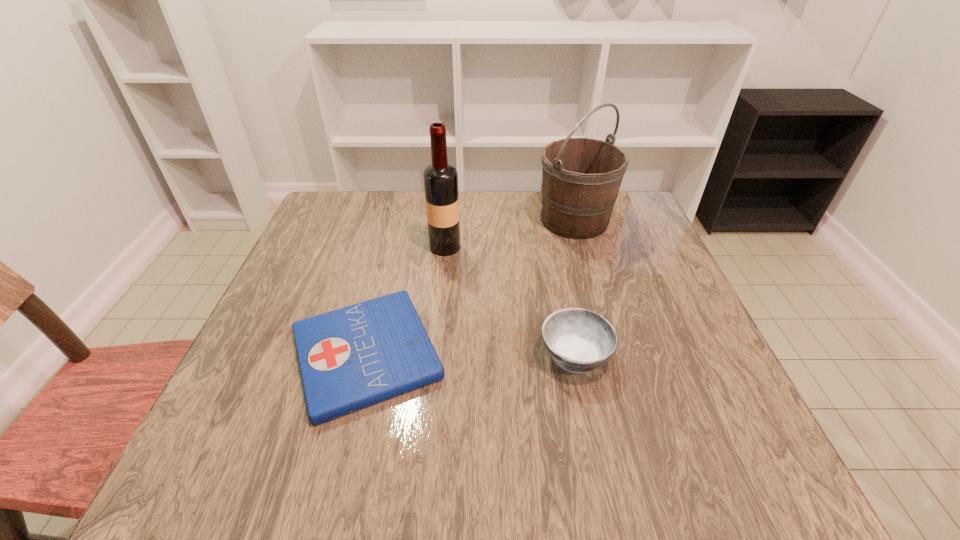
You are a GUI agent. You are given a task and a screenshot of the screen. Output one action in this format:
    pyautogui.click(x=<x>, y=<y>)
    Task: Click on the object present at the left edge
    Image resolution: width=960 pixels, height=540 pixels.
    Given the screenshot: What is the action you would take?
    pos(350,358)

This screenshot has height=540, width=960. Find the location of `object that is at the right edge`. object that is at the right edge is located at coordinates (581, 177).

Identify the location of object situated at the far right corner. This screenshot has width=960, height=540. (581, 177).

In the image, there is a desktop. What are the coordinates of `blank space at the far edge` in the screenshot? It's located at (493, 197).

In the image, there is a desktop. What are the coordinates of `vacant region at the left edge` in the screenshot? It's located at (339, 295).

Locate an element on the screen. The image size is (960, 540). vacant space at the far left corner is located at coordinates (341, 232).

You are a GUI agent. You are given a task and a screenshot of the screen. Output one action in this format:
    pyautogui.click(x=<x>, y=<y>)
    Task: Click on the vacant space at the far right corner
    
    Given the screenshot: What is the action you would take?
    pyautogui.click(x=636, y=211)

Locate an element on the screen. This screenshot has height=540, width=960. vacant space at the near right corner of the desktop is located at coordinates (664, 447).

Find the location of a particular element. free space between the wine bottle and the bucket is located at coordinates click(x=510, y=234).

Identify the location of vacant space that's between the third tallest object and the wine bottle. The image size is (960, 540). (510, 301).